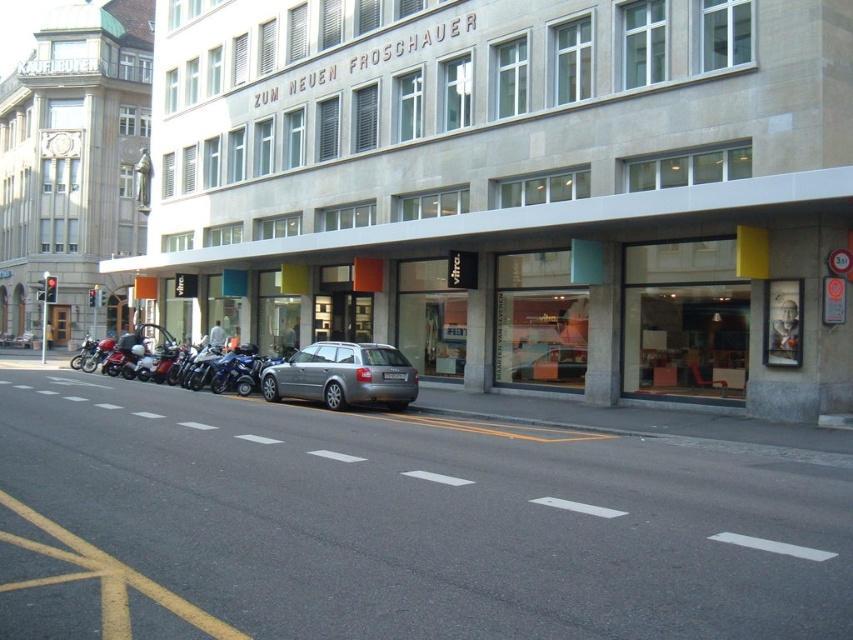
Question: Does silver metallic car at center have a smaller size compared to silver metallic station wagon at center?

Choices:
 (A) yes
 (B) no

Answer: (B)

Question: Which of the following is the closest to the observer?

Choices:
 (A) (453, 29)
 (B) (410, 369)

Answer: (B)

Question: Can you confirm if silver metallic car at center is positioned to the right of silver metallic station wagon at center?

Choices:
 (A) no
 (B) yes

Answer: (A)

Question: Does silver metallic car at center have a lesser width compared to silver metallic station wagon at center?

Choices:
 (A) yes
 (B) no

Answer: (B)

Question: Which object appears farthest from the camera in this image?

Choices:
 (A) silver metallic station wagon at center
 (B) silver metallic car at center

Answer: (A)